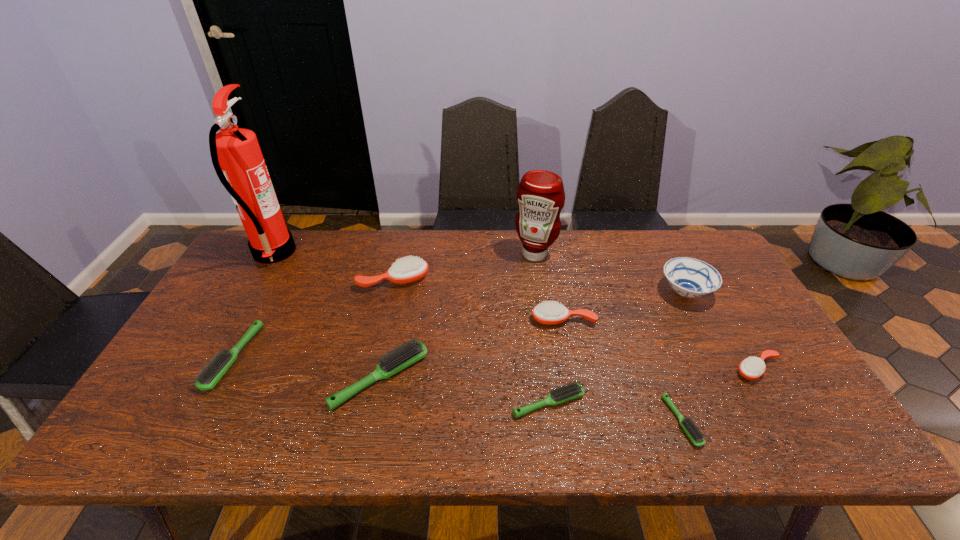
The image size is (960, 540). Find the location of `vacant space located on the front of the soup bowl`. vacant space located on the front of the soup bowl is located at coordinates (707, 335).

I want to click on vacant space situated on the front of the farthest hairbrush, so click(x=388, y=307).

This screenshot has width=960, height=540. In order to click on free space located 0.310m on the left of the second orange hairbrush from left to right in this screenshot , I will do `click(422, 320)`.

You are a GUI agent. You are given a task and a screenshot of the screen. Output one action in this format:
    pyautogui.click(x=<x>, y=<y>)
    Task: Click on the vacant area situated on the back of the third light hairbrush from right to left
    The image size is (960, 540).
    Given the screenshot: What is the action you would take?
    pyautogui.click(x=398, y=286)

Find the location of a particular element. The image size is (960, 540). blank space located on the back of the leftmost hairbrush is located at coordinates click(272, 285).

This screenshot has height=540, width=960. I want to click on vacant space located on the left of the smallest orange hairbrush, so click(x=635, y=369).

Where is `vacant space situated on the back of the ninth tallest object`? vacant space situated on the back of the ninth tallest object is located at coordinates (538, 326).

I want to click on vacant region located 0.150m on the left of the shortest object, so click(x=603, y=421).

Where is `fire extinguisher at the far edge`? The height and width of the screenshot is (540, 960). fire extinguisher at the far edge is located at coordinates (235, 152).

I want to click on condiment located in the far edge section of the desktop, so click(540, 194).